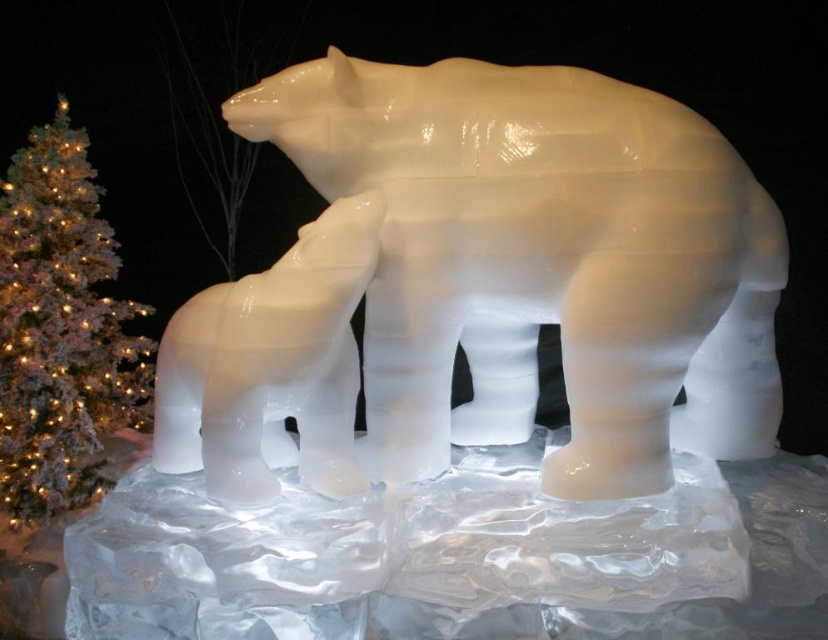
Is white ice sculpture at center above white frosted christmas tree at left?

Correct, white ice sculpture at center is located above white frosted christmas tree at left.

Is white ice sculpture at center behind white frosted christmas tree at left?

No, white ice sculpture at center is in front of white frosted christmas tree at left.

Does point (576, 288) come in front of point (70, 202)?

Yes.

Locate an element on the screen. The image size is (828, 640). white ice sculpture at center is located at coordinates (542, 262).

Is white ice sculpture at center thinner than white ice bear at center?

Incorrect, white ice sculpture at center's width is not less than white ice bear at center's.

Consider the image. Which is more to the left, white ice sculpture at center or white ice bear at center?

white ice bear at center is more to the left.

Does point (532, 147) come behind point (302, 467)?

No, (532, 147) is closer to viewer.

Locate an element on the screen. The width and height of the screenshot is (828, 640). white ice sculpture at center is located at coordinates (542, 262).

In the scene shown: Who is higher up, white ice bear at center or white frosted christmas tree at left?

Positioned higher is white frosted christmas tree at left.

Can you confirm if white ice bear at center is positioned above white frosted christmas tree at left?

No.

At what (x,y) coordinates should I click in order to perform the action: click on white ice bear at center. Please return your answer as a coordinate pair (x, y). Looking at the image, I should click on (272, 365).

The width and height of the screenshot is (828, 640). I want to click on white ice bear at center, so click(x=272, y=365).